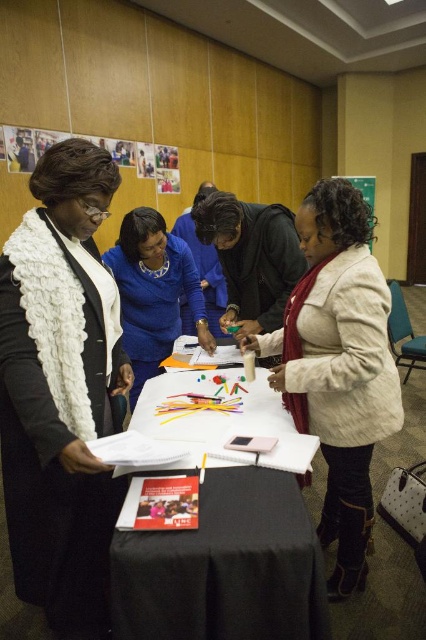
Question: Is white fluffy scarf at upper left thinner than white paper at center?

Choices:
 (A) yes
 (B) no

Answer: (A)

Question: Can you confirm if white fluffy scarf at upper left is wider than white textured coat at center?

Choices:
 (A) yes
 (B) no

Answer: (B)

Question: Does white paper at center come in front of green matte bulletin board at upper center?

Choices:
 (A) yes
 (B) no

Answer: (A)

Question: Which of these objects is positioned farthest from the white fluffy scarf at upper left?

Choices:
 (A) blue fabric shirt at center
 (B) matte black jacket at center
 (C) white textured coat at center
 (D) green matte bulletin board at upper center

Answer: (D)

Question: Which of the following is the farthest from the observer?

Choices:
 (A) (259, 216)
 (B) (146, 301)

Answer: (B)

Question: Which point appears closest to the camera in this image?

Choices:
 (A) (287, 285)
 (B) (175, 296)
 (C) (258, 461)
 (D) (314, 184)

Answer: (C)